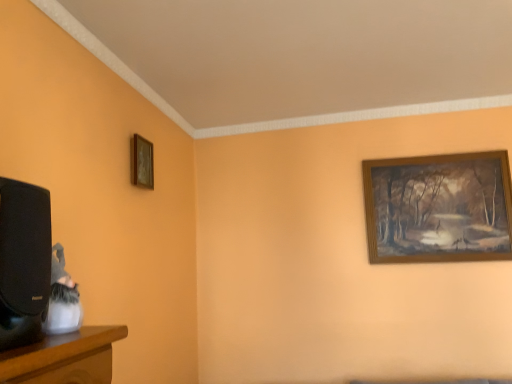
Describe the element at coordinates (143, 162) in the screenshot. I see `wooden picture frame at upper left, the second picture frame positioned from the right` at that location.

Identify the location of wooden picture frame at upper left, the first picture frame positioned from the front. This screenshot has width=512, height=384. (143, 162).

This screenshot has height=384, width=512. What do you see at coordinates (439, 208) in the screenshot? I see `wooden picture frame at upper right, arranged as the 1th picture frame when viewed from the right` at bounding box center [439, 208].

Locate an element on the screen. Image resolution: width=512 pixels, height=384 pixels. wooden picture frame at upper right, which appears as the 1th picture frame when viewed from the back is located at coordinates (439, 208).

Locate an element on the screen. This screenshot has width=512, height=384. wooden picture frame at upper left, which ranks as the second picture frame in back-to-front order is located at coordinates (143, 162).

Based on the photo, based on their positions, is wooden picture frame at upper right, acting as the second picture frame starting from the front, located to the left or right of wooden picture frame at upper left, the second picture frame positioned from the right?

Clearly, wooden picture frame at upper right, acting as the second picture frame starting from the front, is on the right of wooden picture frame at upper left, the second picture frame positioned from the right, in the image.

Which object is further away from the camera, wooden picture frame at upper right, the second picture frame from the left, or wooden picture frame at upper left, which ranks as the second picture frame in back-to-front order?

wooden picture frame at upper right, the second picture frame from the left, is behind.

Considering the points (475, 232) and (152, 174), which point is behind, point (475, 232) or point (152, 174)?

The point (475, 232) is behind.

From the image's perspective, which one is positioned lower, wooden picture frame at upper right, arranged as the 1th picture frame when viewed from the right, or wooden picture frame at upper left, the second picture frame positioned from the right?

From the image's view, wooden picture frame at upper right, arranged as the 1th picture frame when viewed from the right, is below.

From a real-world perspective, is wooden picture frame at upper right, acting as the second picture frame starting from the front, positioned over wooden picture frame at upper left, the second picture frame positioned from the right, based on gravity?

No, from a real-world perspective, wooden picture frame at upper right, acting as the second picture frame starting from the front, is not above wooden picture frame at upper left, the second picture frame positioned from the right.

Does wooden picture frame at upper right, which appears as the 1th picture frame when viewed from the back, have a greater width compared to wooden picture frame at upper left, which ranks as the second picture frame in back-to-front order?

In fact, wooden picture frame at upper right, which appears as the 1th picture frame when viewed from the back, might be narrower than wooden picture frame at upper left, which ranks as the second picture frame in back-to-front order.

Who is shorter, wooden picture frame at upper right, acting as the second picture frame starting from the front, or wooden picture frame at upper left, the second picture frame positioned from the right?

With less height is wooden picture frame at upper left, the second picture frame positioned from the right.

Who is smaller, wooden picture frame at upper right, arranged as the 1th picture frame when viewed from the right, or wooden picture frame at upper left, the first picture frame positioned from the front?

Smaller between the two is wooden picture frame at upper left, the first picture frame positioned from the front.

Is wooden picture frame at upper right, arranged as the 1th picture frame when viewed from the right, outside of wooden picture frame at upper left, which ranks as the second picture frame in back-to-front order?

Yes, wooden picture frame at upper right, arranged as the 1th picture frame when viewed from the right, is not within wooden picture frame at upper left, which ranks as the second picture frame in back-to-front order.

Are wooden picture frame at upper right, the second picture frame from the left, and wooden picture frame at upper left, acting as the first picture frame starting from the left, far apart?

Yes, wooden picture frame at upper right, the second picture frame from the left, and wooden picture frame at upper left, acting as the first picture frame starting from the left, are located far from each other.

Is wooden picture frame at upper right, acting as the second picture frame starting from the front, oriented towards wooden picture frame at upper left, the second picture frame positioned from the right?

No, wooden picture frame at upper right, acting as the second picture frame starting from the front, is not aimed at wooden picture frame at upper left, the second picture frame positioned from the right.

Where is `picture frame above the wooden picture frame at upper right, the second picture frame from the left (from a real-world perspective)`? picture frame above the wooden picture frame at upper right, the second picture frame from the left (from a real-world perspective) is located at coordinates (143, 162).

In the image, is wooden picture frame at upper left, acting as the first picture frame starting from the left, on the left side or the right side of wooden picture frame at upper right, arranged as the 1th picture frame when viewed from the right?

wooden picture frame at upper left, acting as the first picture frame starting from the left, is positioned on wooden picture frame at upper right, arranged as the 1th picture frame when viewed from the right,'s left side.

Is the position of wooden picture frame at upper left, the second picture frame positioned from the right, more distant than that of wooden picture frame at upper right, the second picture frame from the left?

That is False.

Is point (150, 186) positioned behind point (396, 228)?

No, (150, 186) is in front of (396, 228).

From the image's perspective, is wooden picture frame at upper left, which ranks as the second picture frame in back-to-front order, over wooden picture frame at upper right, the second picture frame from the left?

Indeed, from the image's perspective, wooden picture frame at upper left, which ranks as the second picture frame in back-to-front order, is shown above wooden picture frame at upper right, the second picture frame from the left.

From a real-world perspective, relative to wooden picture frame at upper right, which appears as the 1th picture frame when viewed from the back, is wooden picture frame at upper left, which ranks as the second picture frame in back-to-front order, vertically above or below?

In terms of real-world spatial position, wooden picture frame at upper left, which ranks as the second picture frame in back-to-front order, is above wooden picture frame at upper right, which appears as the 1th picture frame when viewed from the back.

Is wooden picture frame at upper left, acting as the first picture frame starting from the left, wider than wooden picture frame at upper right, arranged as the 1th picture frame when viewed from the right?

Yes, wooden picture frame at upper left, acting as the first picture frame starting from the left, is wider than wooden picture frame at upper right, arranged as the 1th picture frame when viewed from the right.

In terms of height, does wooden picture frame at upper left, acting as the first picture frame starting from the left, look taller or shorter compared to wooden picture frame at upper right, which appears as the 1th picture frame when viewed from the back?

Considering their sizes, wooden picture frame at upper left, acting as the first picture frame starting from the left, has less height than wooden picture frame at upper right, which appears as the 1th picture frame when viewed from the back.

Does wooden picture frame at upper left, the second picture frame positioned from the right, have a larger size compared to wooden picture frame at upper right, which appears as the 1th picture frame when viewed from the back?

Incorrect, wooden picture frame at upper left, the second picture frame positioned from the right, is not larger than wooden picture frame at upper right, which appears as the 1th picture frame when viewed from the back.

Would you say wooden picture frame at upper left, acting as the first picture frame starting from the left, contains wooden picture frame at upper right, the second picture frame from the left?

No, wooden picture frame at upper right, the second picture frame from the left, is located outside of wooden picture frame at upper left, acting as the first picture frame starting from the left.

Does wooden picture frame at upper left, which ranks as the second picture frame in back-to-front order, touch wooden picture frame at upper right, the second picture frame from the left?

wooden picture frame at upper left, which ranks as the second picture frame in back-to-front order, and wooden picture frame at upper right, the second picture frame from the left, are not in contact.

Looking at this image, is wooden picture frame at upper right, the second picture frame from the left, at the back of wooden picture frame at upper left, the second picture frame positioned from the right?

No.

How many degrees apart are the facing directions of wooden picture frame at upper left, which ranks as the second picture frame in back-to-front order, and wooden picture frame at upper right, acting as the second picture frame starting from the front?

90.8 degrees separate the facing orientations of wooden picture frame at upper left, which ranks as the second picture frame in back-to-front order, and wooden picture frame at upper right, acting as the second picture frame starting from the front.

This screenshot has width=512, height=384. Find the location of `picture frame above the wooden picture frame at upper right, the second picture frame from the left (from a real-world perspective)`. picture frame above the wooden picture frame at upper right, the second picture frame from the left (from a real-world perspective) is located at coordinates (143, 162).

Identify the location of picture frame in front of the wooden picture frame at upper right, which appears as the 1th picture frame when viewed from the back. (143, 162).

The width and height of the screenshot is (512, 384). In order to click on picture frame below the wooden picture frame at upper left, which ranks as the second picture frame in back-to-front order (from a real-world perspective) in this screenshot , I will do `click(439, 208)`.